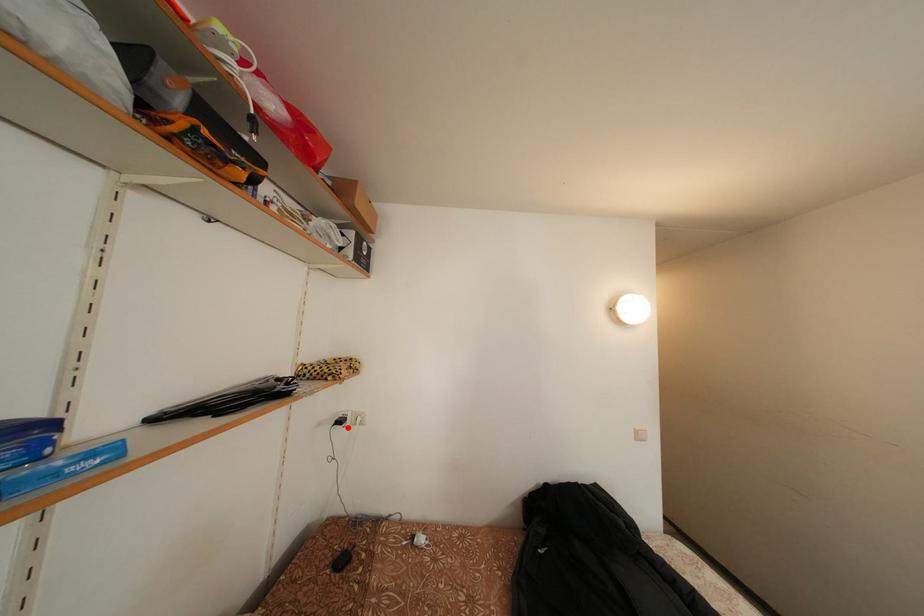
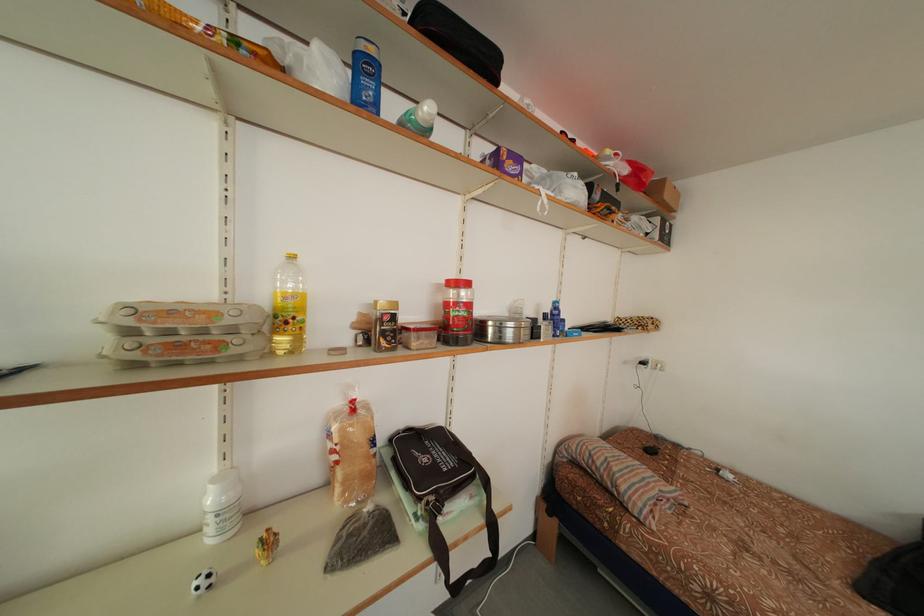
Where in the second image is the point corresponding to the highlighted location from the first image?

(650, 369)